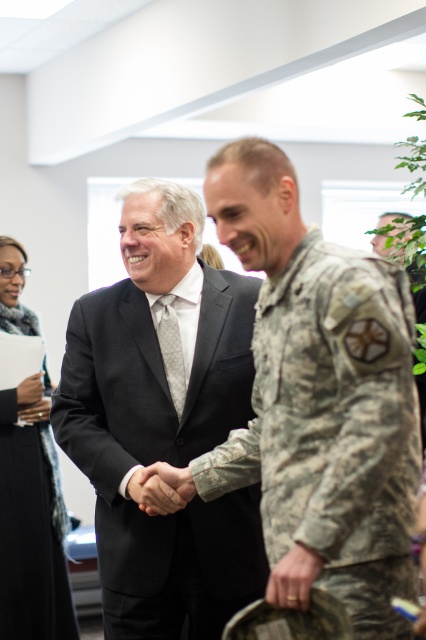
Question: Which of the following is the closest to the observer?

Choices:
 (A) (129, 268)
 (B) (270, 353)
 (C) (49, 476)

Answer: (B)

Question: Which object appears farthest from the camera in this image?

Choices:
 (A) camouflage uniform at center
 (B) black textured coat at lower left

Answer: (B)

Question: Does camouflage uniform at center appear over black matte suit at center?

Choices:
 (A) yes
 (B) no

Answer: (A)

Question: Does camouflage uniform at center appear on the right side of black matte suit at center?

Choices:
 (A) yes
 (B) no

Answer: (A)

Question: Does black matte suit at center appear under black textured coat at lower left?

Choices:
 (A) yes
 (B) no

Answer: (B)

Question: Which of the following is the closest to the observer?

Choices:
 (A) black textured coat at lower left
 (B) camouflage uniform at center
 (C) black matte suit at center

Answer: (B)